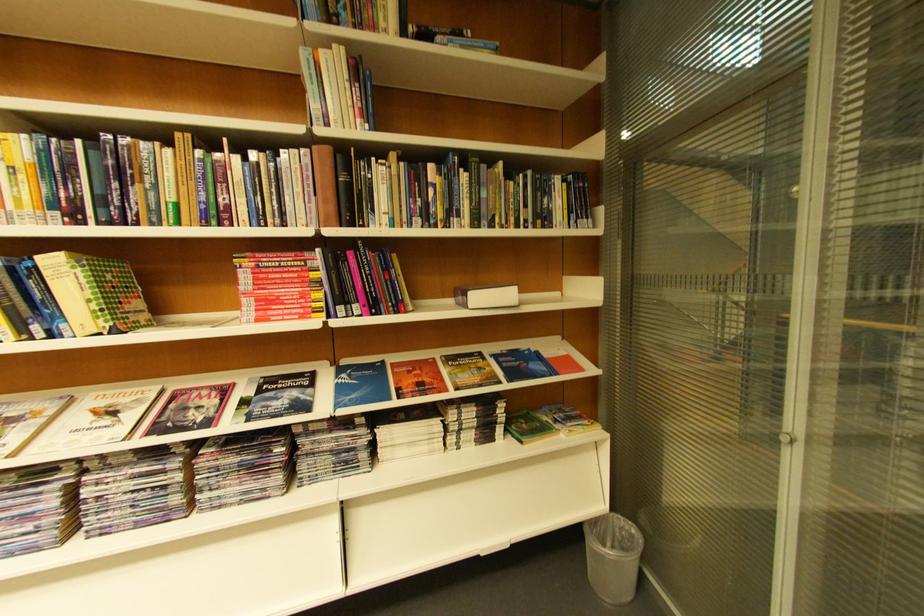
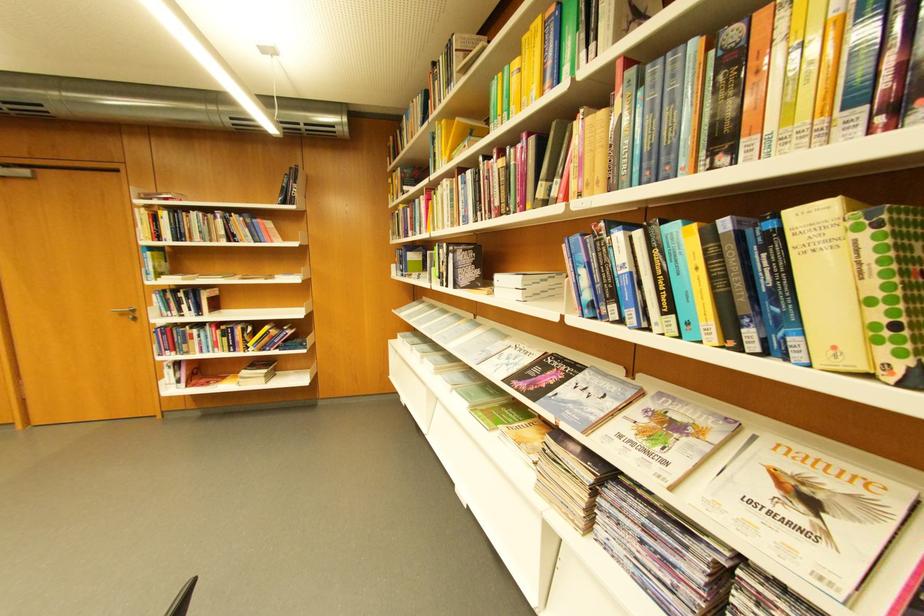
Question: The images are taken continuously from a first-person perspective. In which direction is your viewpoint rotating?

Choices:
 (A) Left
 (B) Right
 (C) Up
 (D) Down

Answer: (A)